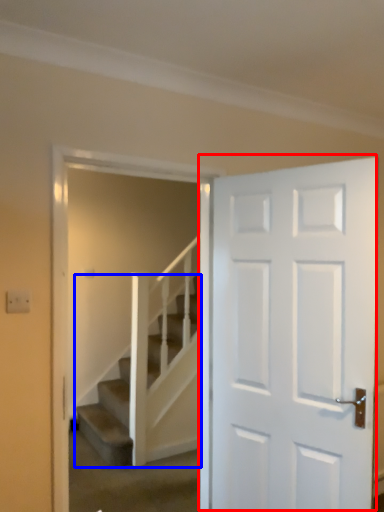
Question: Which object is further to the camera taking this photo, door (highlighted by a red box) or stairs (highlighted by a blue box)?

Choices:
 (A) door
 (B) stairs

Answer: (B)